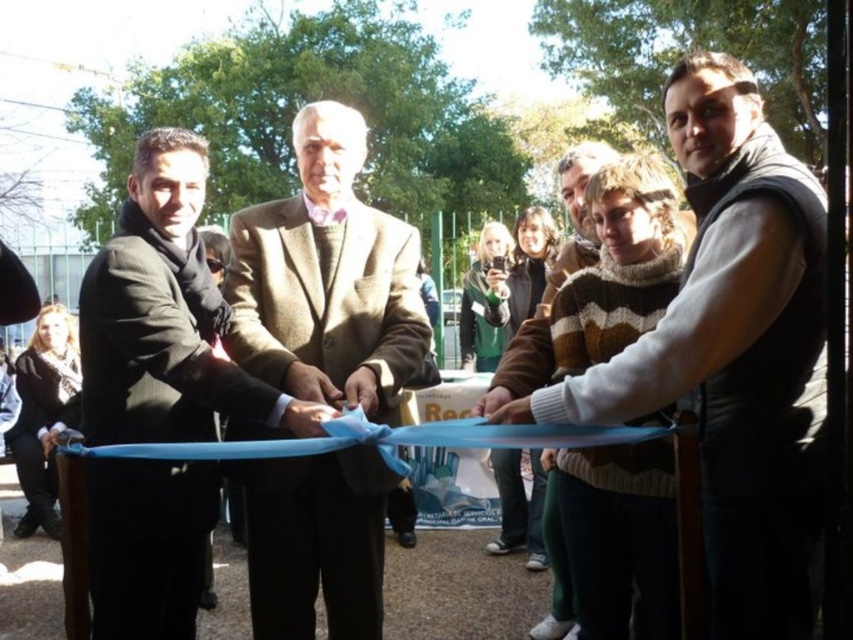
You are attending the ribbon cutting ceremony and notice two attendees wearing brown clothing. One is wearing a velvet brown vest at right, and the other has a brown woolen coat at center. Which attendee is closer to the front of the ceremony?

The velvet brown vest at right is positioned over the brown woolen coat at center, so the attendee wearing the velvet brown vest at right is closer to the front.

You are attending the ribbon cutting ceremony and want to see the people cutting the ribbon clearly. Which participant should you move closer to, the brown woolen coat at center or the matte black suit at center?

You should move closer to the brown woolen coat at center because the matte black suit at center is behind it, so the brown woolen coat at center is closer to you.

You are attending a ribbon cutting ceremony and notice two attendees dressed formally. One is wearing a velvet brown vest at right and the other a matte black suit at center. Based on their positions, which one is closer to the front of the ceremony?

The velvet brown vest at right is positioned over the matte black suit at center, meaning it is closer to the front of the ceremony.